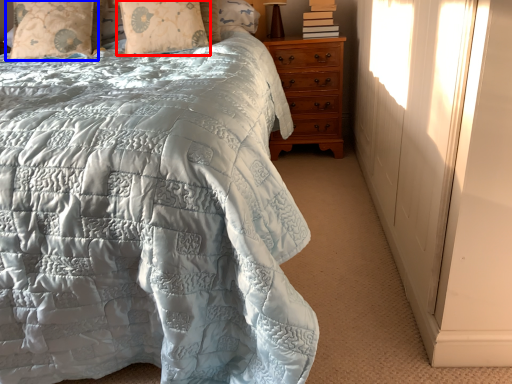
Question: Among these objects, which one is farthest to the camera, pillow (highlighted by a red box) or pillow (highlighted by a blue box)?

Choices:
 (A) pillow
 (B) pillow

Answer: (B)